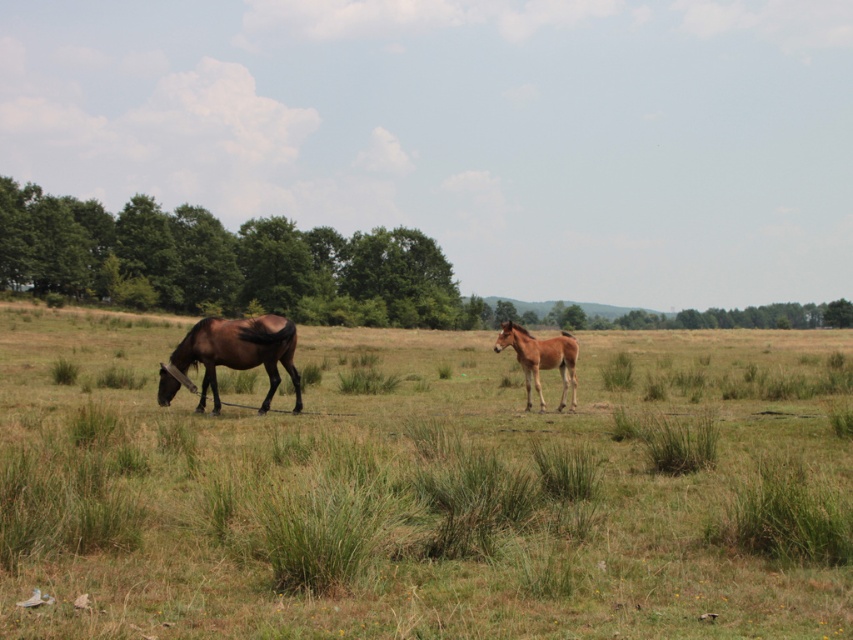
Who is positioned more to the right, brown glossy horse at left or brown glossy horse at center?

brown glossy horse at center

Between brown glossy horse at left and brown glossy horse at center, which one has less height?

brown glossy horse at center is shorter.

Between point (190, 332) and point (573, 355), which one is positioned in front?

Positioned in front is point (190, 332).

I want to click on brown glossy horse at left, so click(239, 353).

Can you confirm if green leafy trees at left is positioned above brown glossy horse at center?

Correct, green leafy trees at left is located above brown glossy horse at center.

Does green leafy trees at left appear under brown glossy horse at center?

No, green leafy trees at left is not below brown glossy horse at center.

Which is behind, point (32, 284) or point (552, 365)?

Point (32, 284)

Image resolution: width=853 pixels, height=640 pixels. Find the location of `green leafy trees at left`. green leafy trees at left is located at coordinates (223, 262).

In the scene shown: Does brown grassland at center appear on the right side of brown glossy horse at center?

Correct, you'll find brown grassland at center to the right of brown glossy horse at center.

Is brown grassland at center positioned before brown glossy horse at center?

Yes, brown grassland at center is in front of brown glossy horse at center.

Describe the element at coordinates (419, 488) in the screenshot. I see `brown grassland at center` at that location.

Locate an element on the screen. This screenshot has height=640, width=853. brown grassland at center is located at coordinates (419, 488).